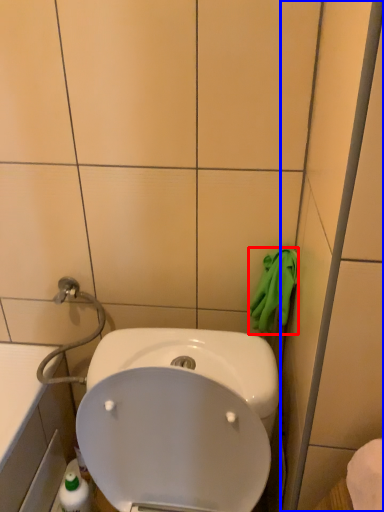
Question: Which object appears closest to the camera in this image, hand towel (highlighted by a red box) or glass door (highlighted by a blue box)?

Choices:
 (A) hand towel
 (B) glass door

Answer: (B)